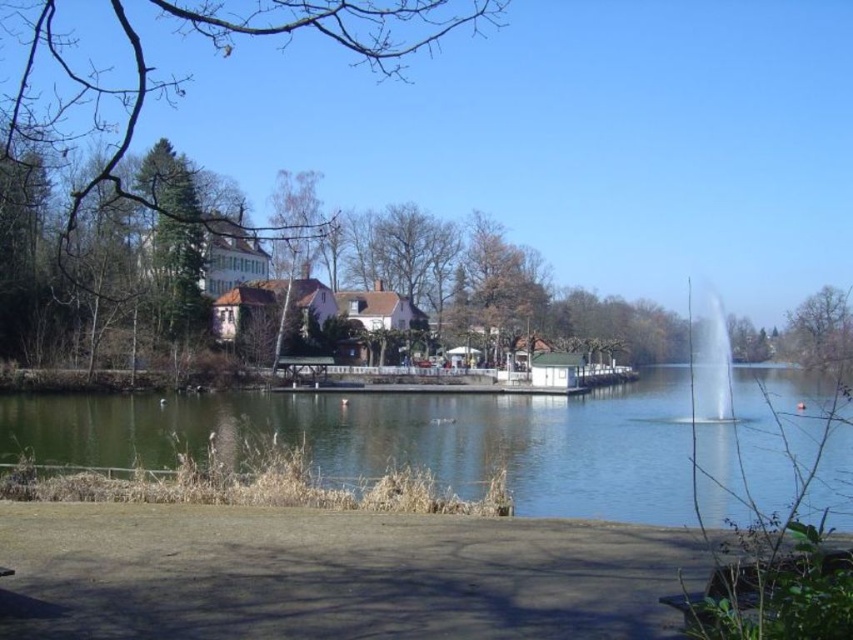
You are planning to plant a new tree in this lakeside area. The green leafy tree at upper left and the bare wood tree at center are already present. Which existing tree has a bigger footprint and would require more space when planting a new one?

The green leafy tree at upper left is larger in size than the bare wood tree at center, so it has a bigger footprint and requires more space.

You are standing at the lower left corner of the image where the paved area with dry grass and branches is located. You want to walk straight towards the green water at center. Will you have to cross the fountain on the right side of the lake to reach it?

The green water at center is located at point (405, 438). Since the fountain is on the right side of the lake and you are starting from the lower left corner, walking straight towards the center would not require crossing the fountain. The fountain is positioned to the right of the lake, so your path would lead you directly toward the center without needing to go near the fountain.

You are planning to place a small statue exactly between the green water at center and the wooden park bench at lower right. Given that the statue requires a 1 meter wide space, can it fit between them?

The green water at center has a larger size compared to wooden park bench at lower right. However, the exact distance between them isn generated from the provided information. Therefore, it is impossible to determine if the statue can fit based on the given data.